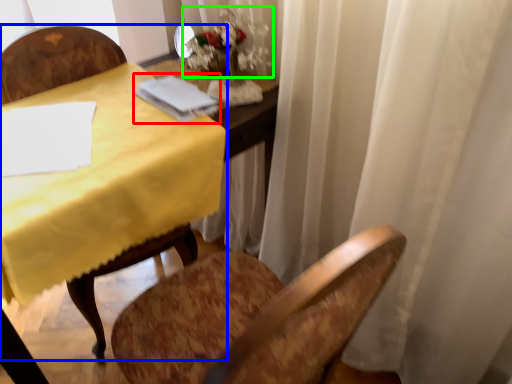
Question: Which is farther away from notebook (highlighted by a red box)? chair (highlighted by a blue box) or floral arrangement (highlighted by a green box)?

Choices:
 (A) chair
 (B) floral arrangement

Answer: (A)